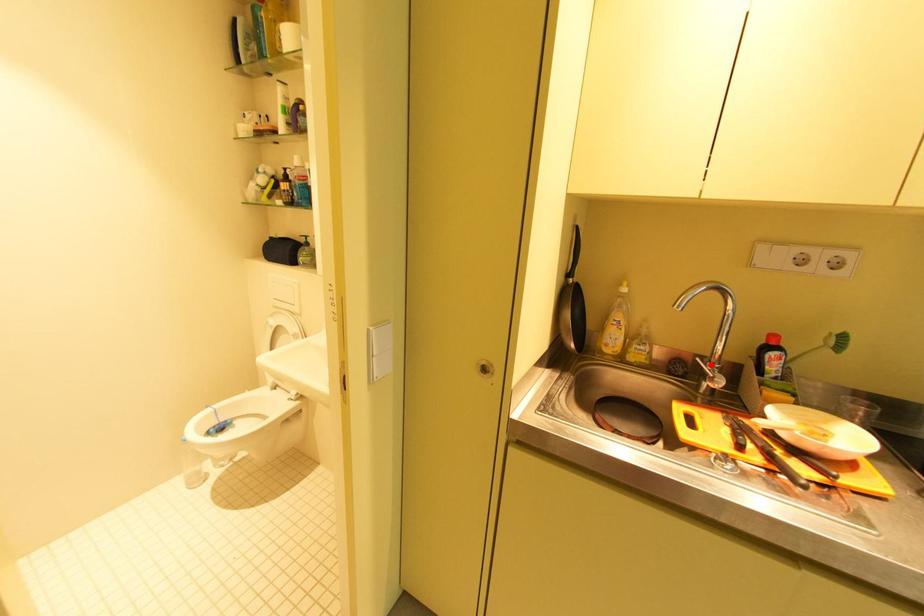
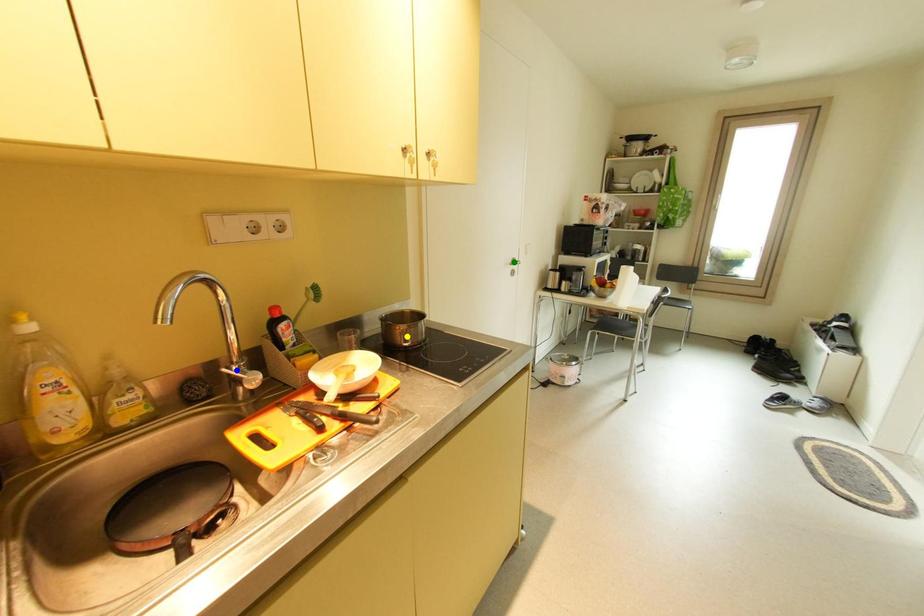
Question: I am providing you with two images of the same scene from different viewpoints. A red point is marked on the first image. You are given multiple points on the second image. Which spot in image 2 lines up with the point in image 1?

Choices:
 (A) blue point
 (B) yellow point
 (C) green point

Answer: (A)